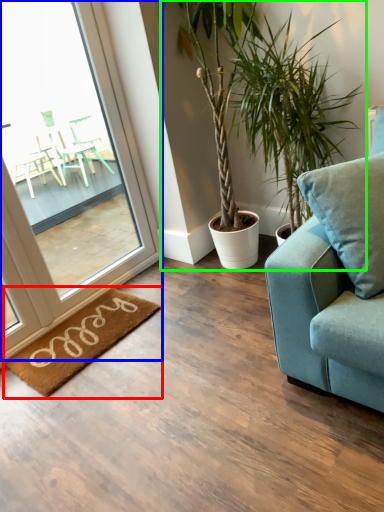
Question: Which object is positioned farthest from mat (highlighted by a red box)? Select from window (highlighted by a blue box) and houseplant (highlighted by a green box).

Choices:
 (A) window
 (B) houseplant

Answer: (B)